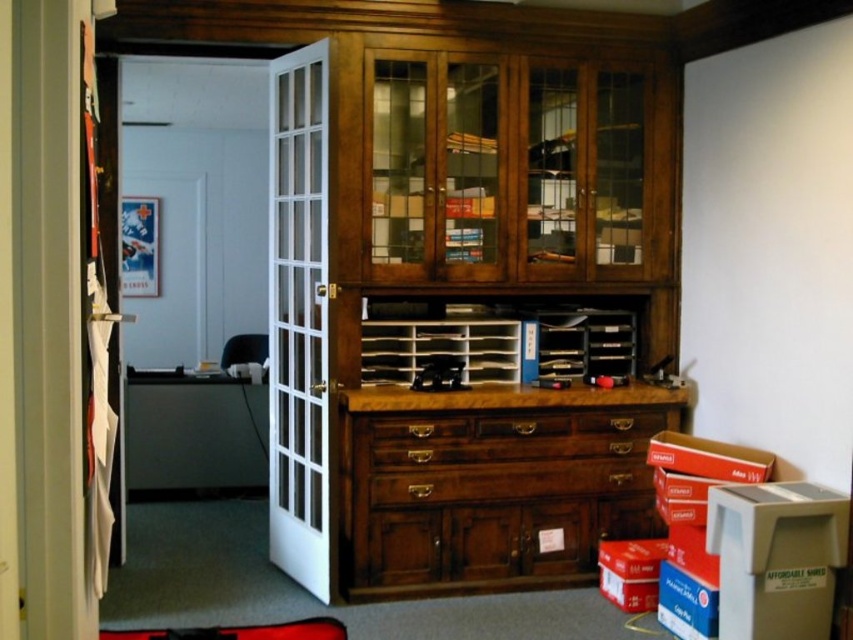
Question: From the image, what is the correct spatial relationship of white glass door at left in relation to brown wood drawer at center?

Choices:
 (A) left
 (B) right

Answer: (A)

Question: Considering the real-world distances, which object is farthest from the white glass door at left?

Choices:
 (A) wooden drawer at center
 (B) brown wood drawer at center

Answer: (B)

Question: Which point is closer to the camera?

Choices:
 (A) wooden drawer at center
 (B) white glass door at left

Answer: (B)

Question: Among these objects, which one is nearest to the camera?

Choices:
 (A) brown wood drawer at center
 (B) wooden drawer at center
 (C) white glass door at left

Answer: (C)

Question: Can you confirm if white glass door at left is wider than wooden drawer at center?

Choices:
 (A) no
 (B) yes

Answer: (A)

Question: Can you confirm if white glass door at left is smaller than wooden drawer at center?

Choices:
 (A) no
 (B) yes

Answer: (A)